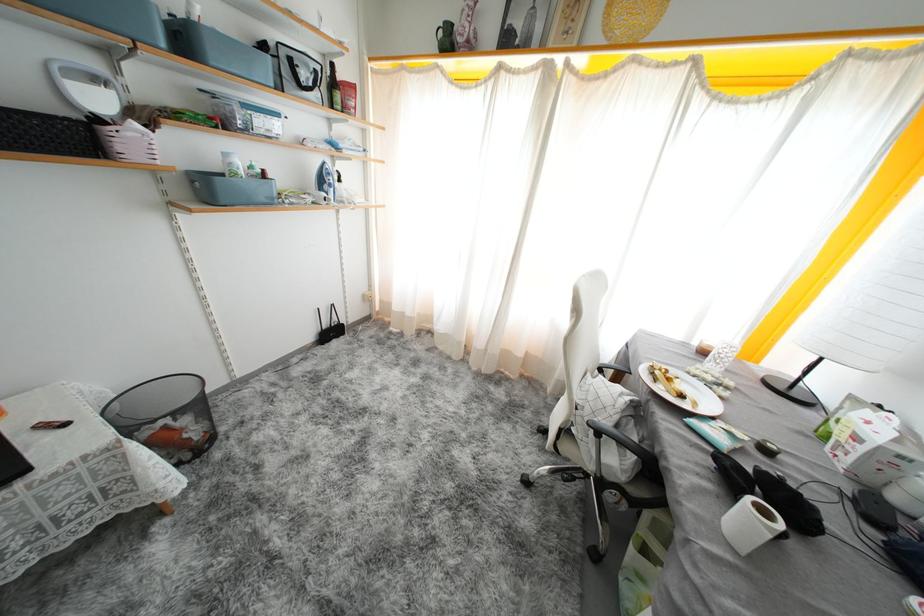
Where is `black computer mouse`? Image resolution: width=924 pixels, height=616 pixels. black computer mouse is located at coordinates (767, 448).